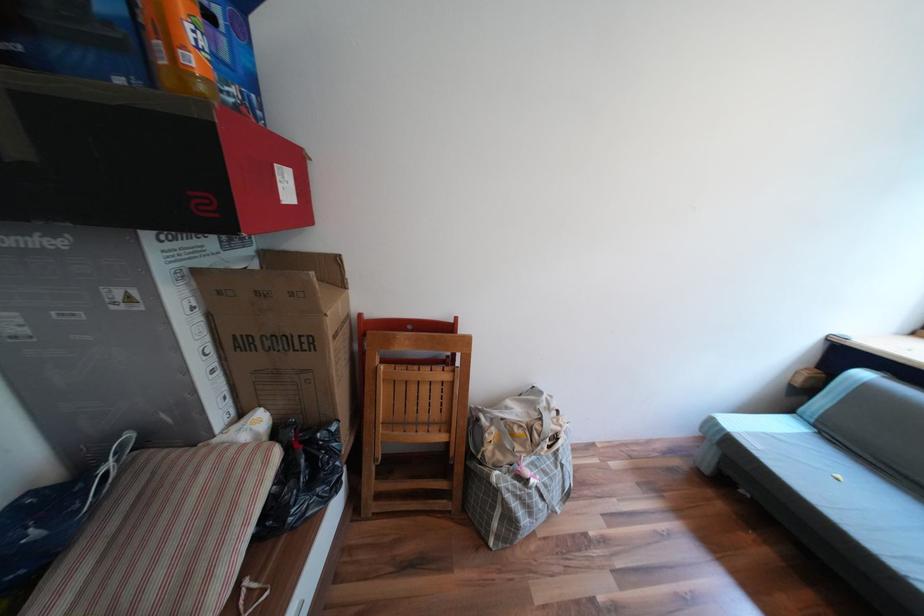
What are the coordinates of `striped cushion` in the screenshot? It's located at (163, 535).